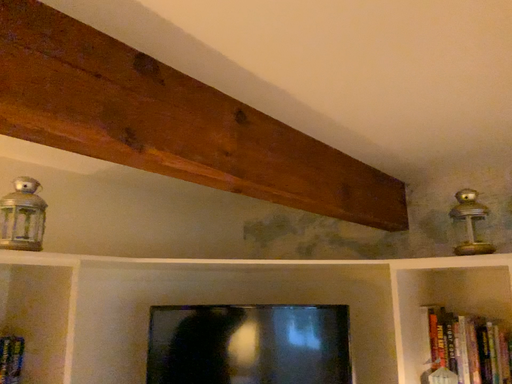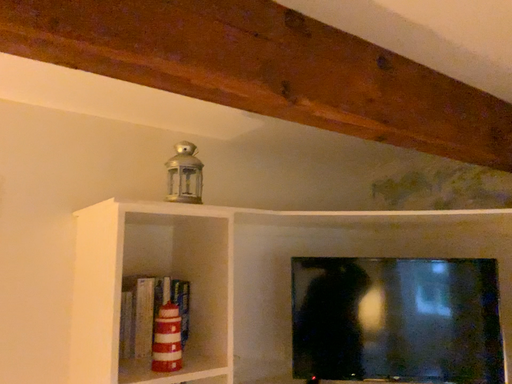
Question: How did the camera likely rotate when shooting the video?

Choices:
 (A) rotated right
 (B) rotated left

Answer: (B)